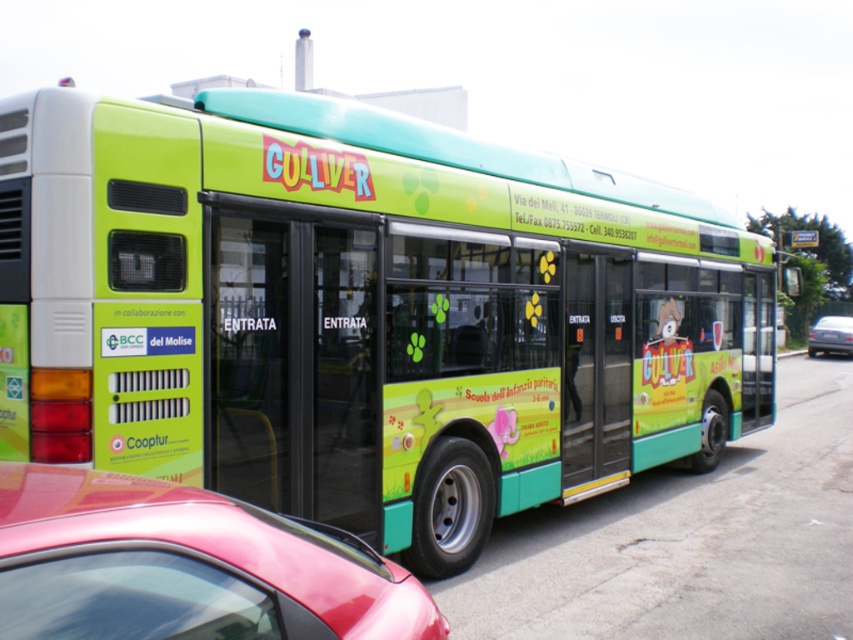
Question: Among these objects, which one is farthest from the camera?

Choices:
 (A) shiny red car at lower left
 (B) black plastic license plate at center
 (C) green matte bus at center
 (D) metallic silver sedan at center

Answer: (B)

Question: Does metallic silver sedan at center come in front of black plastic license plate at center?

Choices:
 (A) no
 (B) yes

Answer: (B)

Question: In this image, where is green matte bus at center located relative to black plastic license plate at center?

Choices:
 (A) left
 (B) right

Answer: (A)

Question: Does shiny red car at lower left have a greater width compared to black plastic license plate at center?

Choices:
 (A) no
 (B) yes

Answer: (B)

Question: Which of the following is the closest to the observer?

Choices:
 (A) pos(329,394)
 (B) pos(844,333)
 (C) pos(207,628)

Answer: (C)

Question: Estimate the real-world distances between objects in this image. Which object is closer to the shiny red car at lower left?

Choices:
 (A) black plastic license plate at center
 (B) metallic silver sedan at center
 (C) green matte bus at center

Answer: (C)